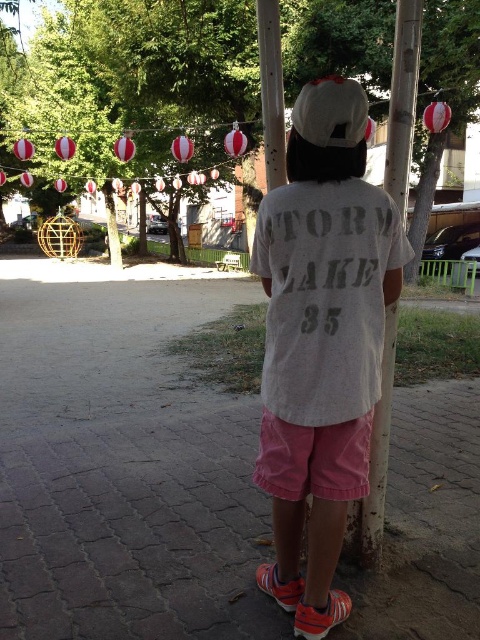
Does rusty metal pole at center appear on the left side of smooth wood pole at center?

Incorrect, rusty metal pole at center is not on the left side of smooth wood pole at center.

Does rusty metal pole at center appear on the right side of smooth wood pole at center?

Yes, rusty metal pole at center is to the right of smooth wood pole at center.

The height and width of the screenshot is (640, 480). What do you see at coordinates (403, 100) in the screenshot?
I see `rusty metal pole at center` at bounding box center [403, 100].

Find the location of `rusty metal pole at center`. rusty metal pole at center is located at coordinates (403, 100).

Based on the photo, is white cotton shirt at center positioned behind green leafy tree at upper center?

No.

At what (x,y) coordinates should I click in order to perform the action: click on white cotton shirt at center. Please return your answer as a coordinate pair (x, y). The height and width of the screenshot is (640, 480). Looking at the image, I should click on (322, 340).

I want to click on white cotton shirt at center, so click(322, 340).

Who is more distant from viewer, (277, 497) or (330, 122)?

The point (277, 497) is more distant.

Is white cotton shirt at center wider than white matte baseball hat at upper center?

Yes, white cotton shirt at center is wider than white matte baseball hat at upper center.

The width and height of the screenshot is (480, 640). In order to click on white cotton shirt at center in this screenshot , I will do `click(322, 340)`.